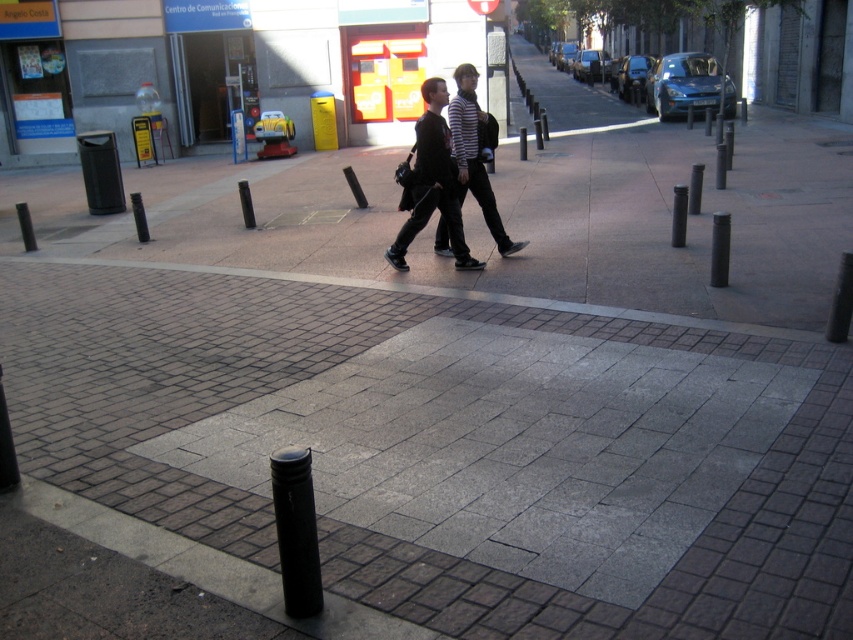
Question: Which of the following is the farthest from the observer?

Choices:
 (A) (305, 461)
 (B) (676, 225)
 (C) (720, 227)
 (D) (419, 141)

Answer: (B)

Question: Can you confirm if black smooth pole at center-right is positioned above black matte pole at center?

Choices:
 (A) no
 (B) yes

Answer: (A)

Question: Which object is closer to the camera taking this photo?

Choices:
 (A) black smooth pole at center-right
 (B) black matte pole at center
 (C) smooth concrete pavement at center

Answer: (C)

Question: Among these points, which one is nearest to the camera?

Choices:
 (A) (680, 198)
 (B) (474, 618)
 (C) (409, 240)
 (D) (299, 467)

Answer: (D)

Question: Is black matte pole at center-right to the left of black matte pole at center from the viewer's perspective?

Choices:
 (A) no
 (B) yes

Answer: (A)

Question: From the image, what is the correct spatial relationship of black smooth pole at center-right in relation to black matte pole at center?

Choices:
 (A) below
 (B) above

Answer: (A)